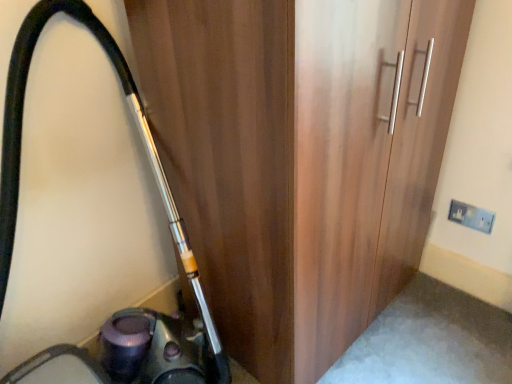
Question: Can you confirm if wooden wardrobe at center is positioned to the left of white plastic electric outlet at upper right?

Choices:
 (A) no
 (B) yes

Answer: (B)

Question: From the image's perspective, is wooden wardrobe at center on white plastic electric outlet at upper right?

Choices:
 (A) no
 (B) yes

Answer: (B)

Question: Can you confirm if wooden wardrobe at center is positioned to the right of white plastic electric outlet at upper right?

Choices:
 (A) yes
 (B) no

Answer: (B)

Question: Does wooden wardrobe at center have a greater width compared to white plastic electric outlet at upper right?

Choices:
 (A) yes
 (B) no

Answer: (A)

Question: Is wooden wardrobe at center positioned far away from white plastic electric outlet at upper right?

Choices:
 (A) yes
 (B) no

Answer: (B)

Question: Is white plastic electric outlet at upper right at the back of wooden wardrobe at center?

Choices:
 (A) yes
 (B) no

Answer: (B)

Question: Can you confirm if metallic vacuum cleaner at left is thinner than wooden wardrobe at center?

Choices:
 (A) no
 (B) yes

Answer: (A)

Question: Is metallic vacuum cleaner at left outside wooden wardrobe at center?

Choices:
 (A) no
 (B) yes

Answer: (B)

Question: From a real-world perspective, is metallic vacuum cleaner at left under wooden wardrobe at center?

Choices:
 (A) yes
 (B) no

Answer: (A)

Question: Is metallic vacuum cleaner at left wider than wooden wardrobe at center?

Choices:
 (A) no
 (B) yes

Answer: (B)

Question: Considering the relative sizes of metallic vacuum cleaner at left and wooden wardrobe at center in the image provided, is metallic vacuum cleaner at left smaller than wooden wardrobe at center?

Choices:
 (A) no
 (B) yes

Answer: (B)

Question: From the image's perspective, is metallic vacuum cleaner at left beneath wooden wardrobe at center?

Choices:
 (A) yes
 (B) no

Answer: (A)

Question: Would you say white plastic electric outlet at upper right contains wooden wardrobe at center?

Choices:
 (A) no
 (B) yes

Answer: (A)